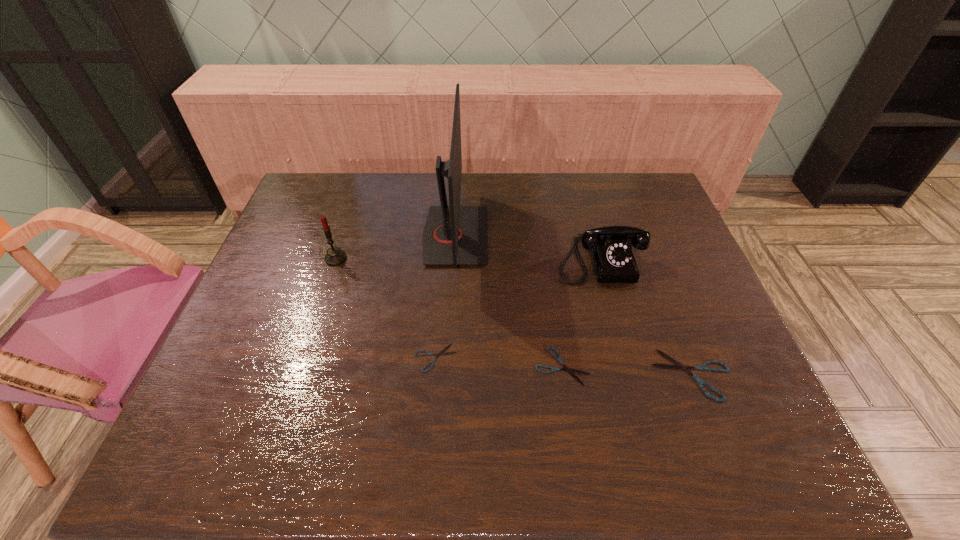
The width and height of the screenshot is (960, 540). Find the location of `the shortest object`. the shortest object is located at coordinates (428, 353).

Find the location of a particular element. This screenshot has width=960, height=540. the leftmost shears is located at coordinates (428, 353).

Find the location of `the second tallest shears`. the second tallest shears is located at coordinates (570, 371).

Locate an element on the screen. The height and width of the screenshot is (540, 960). the second shortest object is located at coordinates click(570, 371).

Identify the location of the tallest shears. This screenshot has height=540, width=960. coord(678,365).

I want to click on the fourth tallest object, so click(x=678, y=365).

Image resolution: width=960 pixels, height=540 pixels. In order to click on monitor in this screenshot , I will do `click(454, 235)`.

This screenshot has height=540, width=960. In order to click on telephone in this screenshot , I will do `click(610, 247)`.

I want to click on the second tallest object, so click(335, 256).

You are a GUI agent. You are given a task and a screenshot of the screen. Output one action in this format:
    pyautogui.click(x=<x>, y=<y>)
    Task: Click on the leftmost object
    
    Given the screenshot: What is the action you would take?
    pyautogui.click(x=335, y=256)